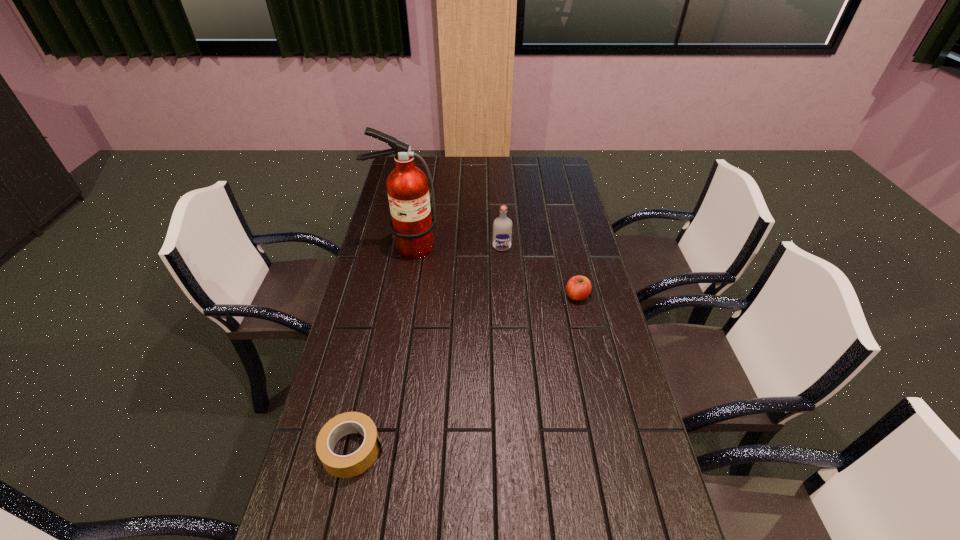
Find the location of `vacant space located at the edge of the nearest object`. vacant space located at the edge of the nearest object is located at coordinates (538, 449).

Where is `fire extinguisher present at the left edge`? The image size is (960, 540). fire extinguisher present at the left edge is located at coordinates (407, 186).

In order to click on duct tape at the left edge in this screenshot , I will do `click(354, 464)`.

At what (x,y) coordinates should I click in order to perform the action: click on object that is positioned at the right edge. Please return your answer as a coordinate pair (x, y). The height and width of the screenshot is (540, 960). Looking at the image, I should click on (578, 288).

In the image, there is a desktop. At what (x,y) coordinates should I click in order to perform the action: click on free space at the far edge. Please return your answer as a coordinate pair (x, y). Looking at the image, I should click on (453, 164).

The width and height of the screenshot is (960, 540). In the image, there is a desktop. Identify the location of vacant space at the left edge. click(x=367, y=258).

The height and width of the screenshot is (540, 960). In the image, there is a desktop. What are the coordinates of `vacant space at the right edge` in the screenshot? It's located at (559, 260).

This screenshot has width=960, height=540. What are the coordinates of `free space between the fire extinguisher and the duct tape` in the screenshot? It's located at (380, 348).

Where is `vacant space that is in between the shortest object and the third object from left to right`? Image resolution: width=960 pixels, height=540 pixels. vacant space that is in between the shortest object and the third object from left to right is located at coordinates (427, 348).

This screenshot has height=540, width=960. I want to click on free point between the shortest object and the second nearest object, so click(x=465, y=373).